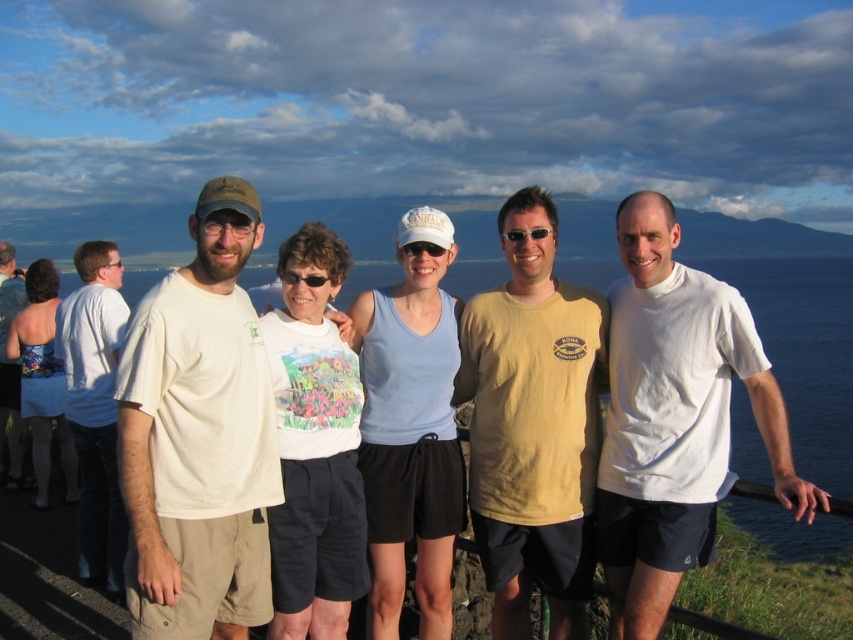
Question: Is white matte goggles at center bigger than sunglasses at center?

Choices:
 (A) yes
 (B) no

Answer: (B)

Question: Considering the real-world distances, which object is closest to the white cotton shirt at left?

Choices:
 (A) matte yellow t-shirt at center
 (B) white matte t-shirt at center
 (C) sunglasses at center

Answer: (C)

Question: Is the position of white matte t-shirt at center more distant than that of white t-shirt at left?

Choices:
 (A) no
 (B) yes

Answer: (A)

Question: Which point is closer to the camera taking this photo?

Choices:
 (A) (524, 250)
 (B) (140, 465)
 (C) (434, 256)

Answer: (B)

Question: Which point appears closest to the camera in this image?

Choices:
 (A) (515, 237)
 (B) (585, 552)
 (C) (192, 280)

Answer: (C)

Question: Is matte yellow t-shirt at center wider than white matte goggles at center?

Choices:
 (A) yes
 (B) no

Answer: (A)